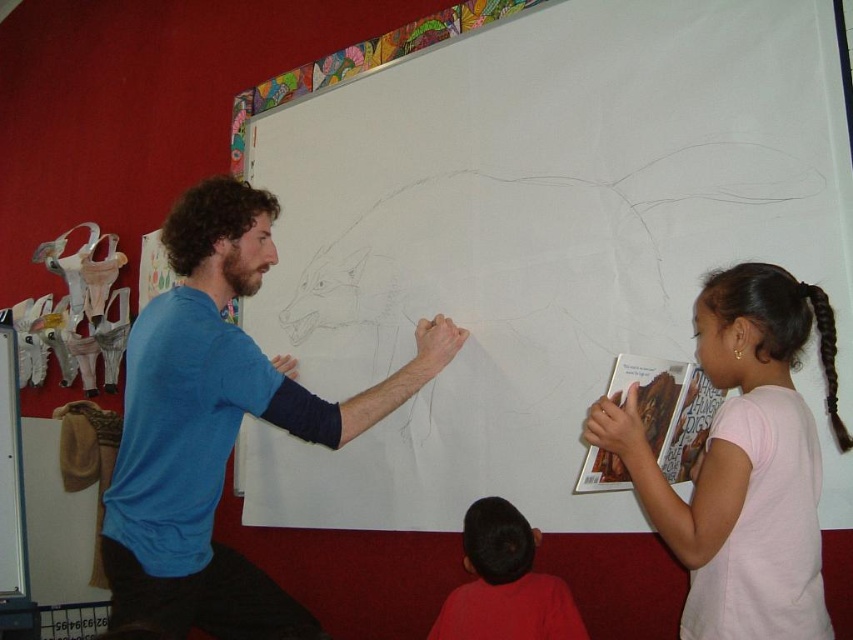
You are standing in the classroom facing the whiteboard. There are two points marked on the wall. One is at point coordinates point (231, 627) and the other at point coordinates point (436, 627). Which point is closer to you?

Point (436, 627) is closer to you because it is in front of point (231, 627).

You are a student in the classroom and want to hand in an assignment to the teacher. The teacher is standing near the whiteboard. To reach the teacher, you need to walk around either the pink cotton shirt at right or the black braided hair at upper right. Which object do you need to go around first based on their heights?

The pink cotton shirt at right has a greater height compared to the black braided hair at upper right. Therefore, you should go around the pink cotton shirt at right first since it is taller and closer to your path.